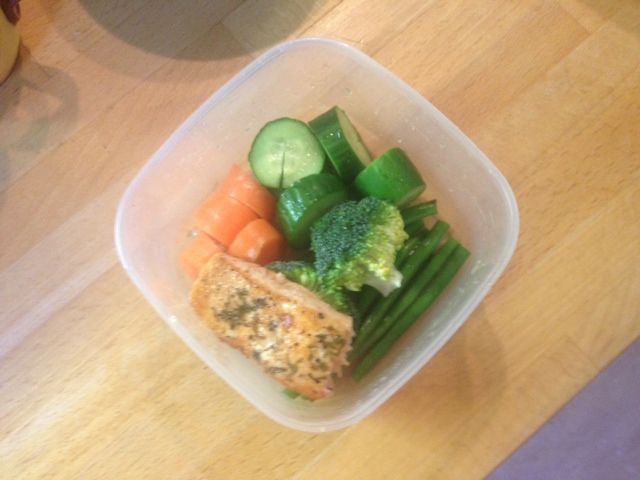
Find the location of a particular element. cup is located at coordinates (4, 32).